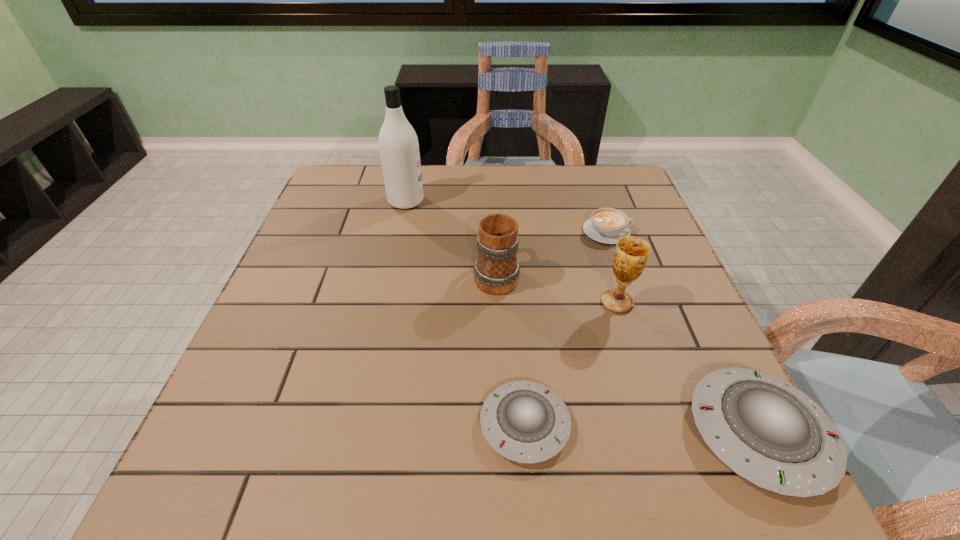
This screenshot has height=540, width=960. I want to click on vacant space located 0.050m on the side of the cappuccino with the handle, so click(651, 232).

I want to click on free location located on the front-facing side of the tallest object, so click(x=528, y=201).

Find the location of `vacant space located 0.320m on the side of the mug with the handle`. vacant space located 0.320m on the side of the mug with the handle is located at coordinates pyautogui.click(x=492, y=184).

Where is `vacant space located on the side of the mug with the handle`? The width and height of the screenshot is (960, 540). vacant space located on the side of the mug with the handle is located at coordinates (494, 222).

The height and width of the screenshot is (540, 960). In order to click on free space located 0.140m on the side of the mug with the handle in this screenshot , I will do `click(494, 220)`.

Where is `free region located on the left of the chalice`? Image resolution: width=960 pixels, height=540 pixels. free region located on the left of the chalice is located at coordinates (527, 302).

The width and height of the screenshot is (960, 540). Identify the location of object at the far edge. (398, 143).

Locate an element on the screen. saucer that is at the right edge is located at coordinates click(768, 432).

Image resolution: width=960 pixels, height=540 pixels. What are the coordinates of `cappuccino positioned at the right edge` in the screenshot? It's located at (607, 225).

The height and width of the screenshot is (540, 960). What are the coordinates of `chalice that is at the right edge` in the screenshot? It's located at (631, 253).